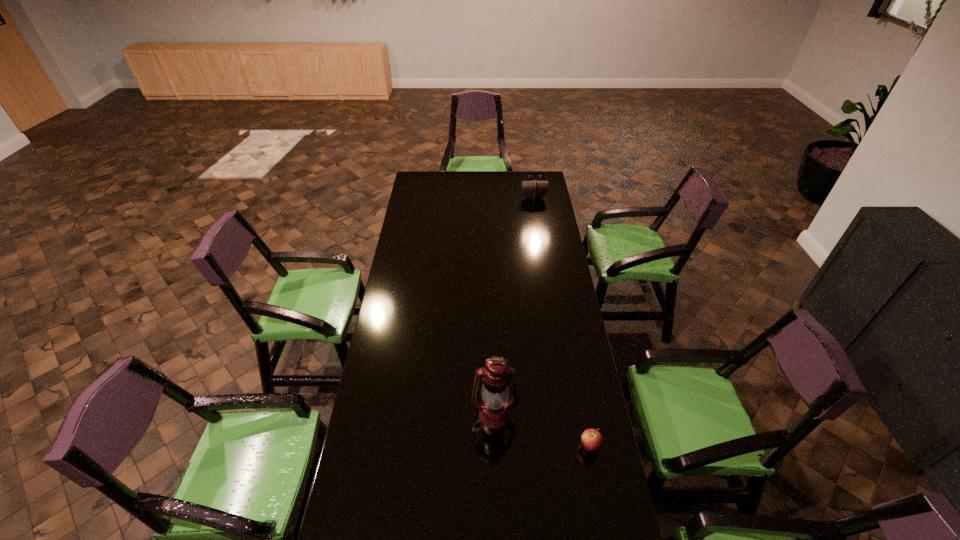
The width and height of the screenshot is (960, 540). What are the coordinates of `the tallest object` in the screenshot? It's located at (494, 414).

Locate an element on the screen. Image resolution: width=960 pixels, height=540 pixels. the second farthest object is located at coordinates (494, 414).

What are the coordinates of `the second shortest object` in the screenshot? It's located at (534, 190).

I want to click on the farthest object, so click(x=534, y=190).

Locate an element on the screen. apple is located at coordinates (592, 440).

Where is `the nearest object`? the nearest object is located at coordinates (592, 440).

This screenshot has height=540, width=960. Find the location of `free space located on the back of the leftmost object`. free space located on the back of the leftmost object is located at coordinates (492, 329).

This screenshot has height=540, width=960. In order to click on vacant space situated 0.190m with the flap open on the second shortest object in this screenshot , I will do `click(538, 221)`.

Where is `free space located 0.360m on the left of the shortest object`? Image resolution: width=960 pixels, height=540 pixels. free space located 0.360m on the left of the shortest object is located at coordinates (475, 447).

Find the location of a particular element. The image size is (960, 540). pouch situated at the right edge is located at coordinates (534, 190).